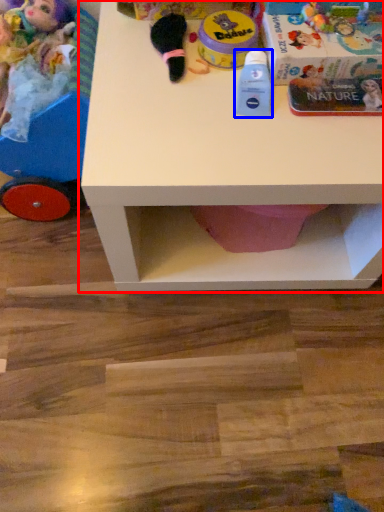
Question: Which object is further to the camera taking this photo, table (highlighted by a red box) or toy (highlighted by a blue box)?

Choices:
 (A) table
 (B) toy

Answer: (B)